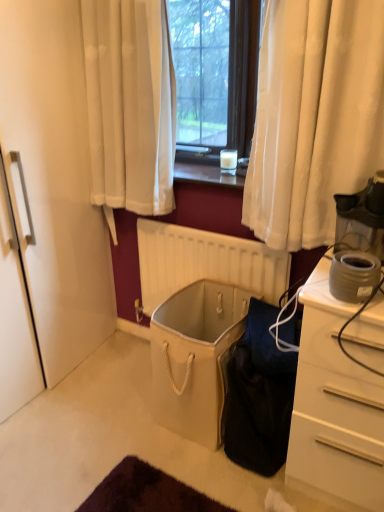
Question: From a real-world perspective, is transparent plastic coffee maker at right, positioned as the 1th appliance in top-to-bottom order, on top of matte gray coffee maker at right, which is counted as the 1th appliance, starting from the bottom?

Choices:
 (A) no
 (B) yes

Answer: (B)

Question: Is transparent plastic coffee maker at right, the 2th appliance from the bottom, to the right of matte gray coffee maker at right, which is the second appliance in top-to-bottom order, from the viewer's perspective?

Choices:
 (A) no
 (B) yes

Answer: (B)

Question: Is transparent plastic coffee maker at right, the 2th appliance from the bottom, turned away from matte gray coffee maker at right, which is the second appliance in top-to-bottom order?

Choices:
 (A) no
 (B) yes

Answer: (A)

Question: From the image's perspective, is transparent plastic coffee maker at right, the 2th appliance from the bottom, beneath matte gray coffee maker at right, which is the second appliance in top-to-bottom order?

Choices:
 (A) yes
 (B) no

Answer: (B)

Question: From the image's perspective, would you say transparent plastic coffee maker at right, the 2th appliance from the bottom, is positioned over matte gray coffee maker at right, which is counted as the 1th appliance, starting from the bottom?

Choices:
 (A) no
 (B) yes

Answer: (B)

Question: Does transparent plastic coffee maker at right, positioned as the 1th appliance in top-to-bottom order, have a greater height compared to matte gray coffee maker at right, which is counted as the 1th appliance, starting from the bottom?

Choices:
 (A) yes
 (B) no

Answer: (A)

Question: Is transparent plastic coffee maker at right, positioned as the 1th appliance in top-to-bottom order, looking in the opposite direction of black fabric bag at lower center?

Choices:
 (A) yes
 (B) no

Answer: (B)

Question: Could you tell me if transparent plastic coffee maker at right, the 2th appliance from the bottom, is turned towards black fabric bag at lower center?

Choices:
 (A) yes
 (B) no

Answer: (B)

Question: From a real-world perspective, is transparent plastic coffee maker at right, the 2th appliance from the bottom, positioned under black fabric bag at lower center based on gravity?

Choices:
 (A) no
 (B) yes

Answer: (A)

Question: Is transparent plastic coffee maker at right, the 2th appliance from the bottom, beside black fabric bag at lower center?

Choices:
 (A) yes
 (B) no

Answer: (B)

Question: Is transparent plastic coffee maker at right, the 2th appliance from the bottom, taller than black fabric bag at lower center?

Choices:
 (A) no
 (B) yes

Answer: (A)

Question: Is black fabric bag at lower center a part of matte gray coffee maker at right, which is counted as the 1th appliance, starting from the bottom?

Choices:
 (A) no
 (B) yes

Answer: (A)